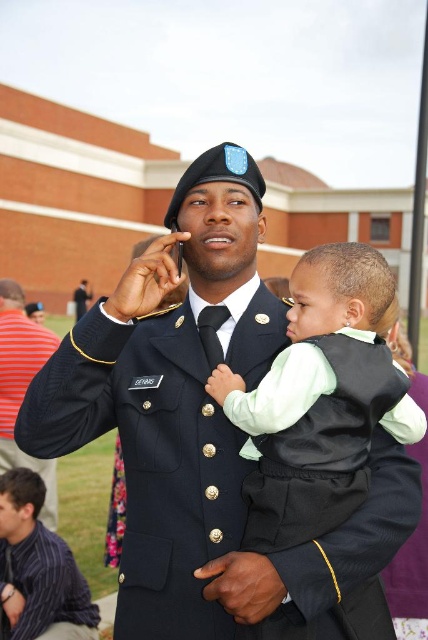
Question: Which object appears closest to the camera in this image?

Choices:
 (A) soft green fabric vest at center
 (B) uniformed man at center
 (C) shiny black uniform at center
 (D) brushed metal uniform at center

Answer: (B)

Question: Which object is closer to the camera taking this photo?

Choices:
 (A) uniformed man at center
 (B) brushed metal uniform at center
 (C) soft green fabric vest at center

Answer: (A)

Question: Which point is farther to the camera?

Choices:
 (A) (291, 348)
 (B) (160, 480)

Answer: (B)

Question: Can you confirm if uniformed man at center is positioned above brushed metal uniform at center?

Choices:
 (A) yes
 (B) no

Answer: (A)

Question: Can you confirm if brushed metal uniform at center is positioned above shiny black uniform at center?

Choices:
 (A) yes
 (B) no

Answer: (B)

Question: Can you confirm if uniformed man at center is positioned below shiny black uniform at center?

Choices:
 (A) yes
 (B) no

Answer: (B)